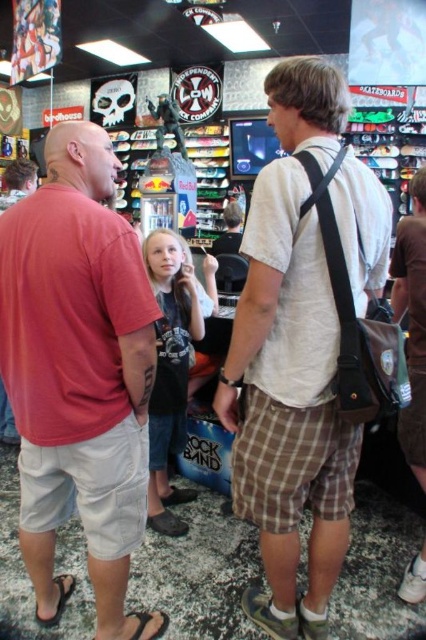
Is matte red t-shirt at left to the right of light brown plaid shorts at center from the viewer's perspective?

In fact, matte red t-shirt at left is to the left of light brown plaid shorts at center.

Which is in front, point (31, 548) or point (302, 282)?

Positioned in front is point (302, 282).

Who is more forward, [52,205] or [336,122]?

Positioned in front is point [52,205].

At what (x,y) coordinates should I click in order to perform the action: click on matte red t-shirt at left. Please return your answer as a coordinate pair (x, y). This screenshot has height=640, width=426. Looking at the image, I should click on (78, 372).

Who is more distant from viewer, (81, 192) or (412, 211)?

The point (412, 211) is behind.

Which is above, matte red t-shirt at left or brown plaid shorts at lower right?

Positioned higher is brown plaid shorts at lower right.

Is point (149, 394) positioned in front of point (419, 368)?

Yes, point (149, 394) is in front of point (419, 368).

In order to click on matte red t-shirt at left in this screenshot , I will do `click(78, 372)`.

Looking at this image, who is positioned more to the left, light brown plaid shorts at center or brown plaid shorts at lower right?

From the viewer's perspective, light brown plaid shorts at center appears more on the left side.

Is light brown plaid shorts at center bigger than brown plaid shorts at lower right?

Yes, light brown plaid shorts at center is bigger than brown plaid shorts at lower right.

Is point (273, 301) positioned behind point (422, 291)?

No, it is not.

Where is `light brown plaid shorts at center`? light brown plaid shorts at center is located at coordinates (290, 362).